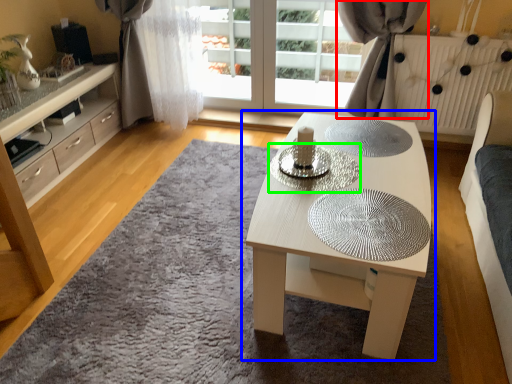
Question: Which object is positioned closest to curtain (highlighted by a red box)? Select from coffee table (highlighted by a blue box) and glass plate (highlighted by a green box).

Choices:
 (A) coffee table
 (B) glass plate

Answer: (A)